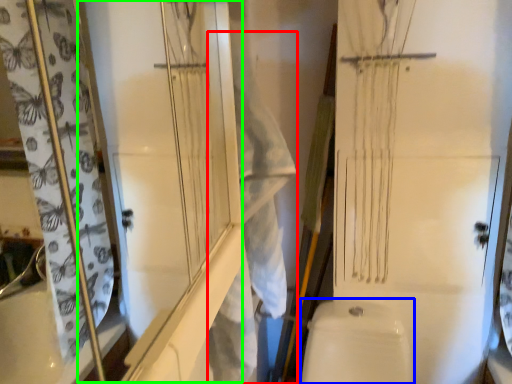
Question: Which object is the closest to the laundry (highlighted by a red box)? Choose among these: toilet bowl (highlighted by a blue box) or screen door (highlighted by a green box).

Choices:
 (A) toilet bowl
 (B) screen door

Answer: (B)